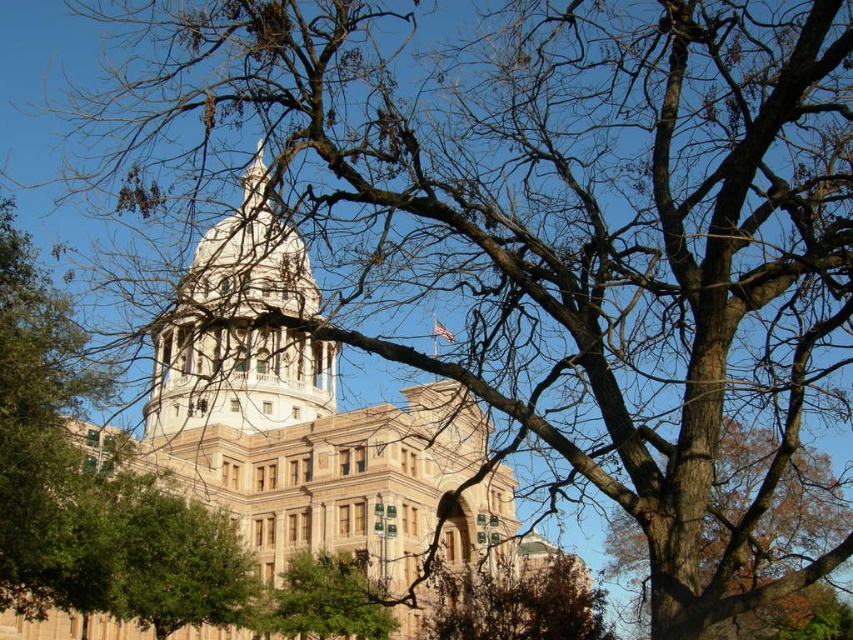
You are a photographer planning to capture the grand building in the image. You notice the brown rough bark tree at center right and the brown textured tree at lower center might block the view. Which tree has a wider trunk to consider when framing your shot?

The brown rough bark tree at center right has a wider trunk than the brown textured tree at lower center, so it might block the view more significantly when framing the shot.

You are standing at the center of the image and want to locate the beige stone tower at center. Which direction should you look to find it?

The beige stone tower at center is located at point 0.700 on the x axis and 0.358 on the y axis, so you should look to the right and slightly downward from the center to find it.

You are an architect analyzing the image of a historic building. You notice the beige stone tower at center and the green leafy tree at center. Which object appears wider in the image?

The beige stone tower at center appears wider than the green leafy tree at center because its width is larger according to the description.